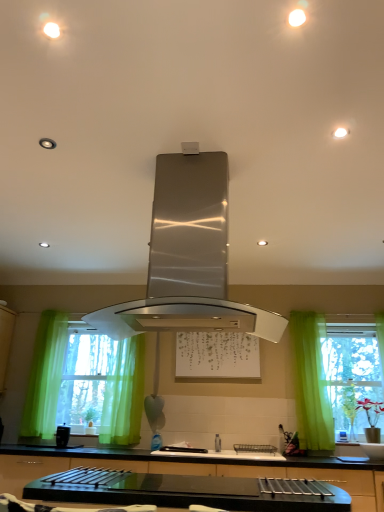
Question: Considering the relative sizes of white matte bulletin board at center and green sheer curtains at left in the image provided, is white matte bulletin board at center bigger than green sheer curtains at left?

Choices:
 (A) yes
 (B) no

Answer: (B)

Question: Is white matte bulletin board at center positioned with its back to green sheer curtains at left?

Choices:
 (A) no
 (B) yes

Answer: (A)

Question: From the image's perspective, would you say white matte bulletin board at center is shown under green sheer curtains at left?

Choices:
 (A) yes
 (B) no

Answer: (B)

Question: Is there a large distance between white matte bulletin board at center and green sheer curtains at left?

Choices:
 (A) yes
 (B) no

Answer: (B)

Question: Considering the relative sizes of white matte bulletin board at center and green sheer curtains at left in the image provided, is white matte bulletin board at center thinner than green sheer curtains at left?

Choices:
 (A) no
 (B) yes

Answer: (B)

Question: Would you say white matte bulletin board at center is outside green sheer curtains at left?

Choices:
 (A) no
 (B) yes

Answer: (B)

Question: From a real-world perspective, is satin silver range hood at center under matte black coffee maker at lower left?

Choices:
 (A) yes
 (B) no

Answer: (B)

Question: Considering the relative sizes of satin silver range hood at center and matte black coffee maker at lower left in the image provided, is satin silver range hood at center thinner than matte black coffee maker at lower left?

Choices:
 (A) no
 (B) yes

Answer: (A)

Question: Considering the relative sizes of satin silver range hood at center and matte black coffee maker at lower left in the image provided, is satin silver range hood at center bigger than matte black coffee maker at lower left?

Choices:
 (A) no
 (B) yes

Answer: (B)

Question: Can you confirm if satin silver range hood at center is positioned to the left of matte black coffee maker at lower left?

Choices:
 (A) yes
 (B) no

Answer: (B)

Question: Is matte black coffee maker at lower left a part of satin silver range hood at center?

Choices:
 (A) no
 (B) yes

Answer: (A)

Question: Is satin silver range hood at center outside of matte black coffee maker at lower left?

Choices:
 (A) yes
 (B) no

Answer: (A)

Question: Is satin nickel faucet at center surrounded by matte black coffee maker at lower left?

Choices:
 (A) yes
 (B) no

Answer: (B)